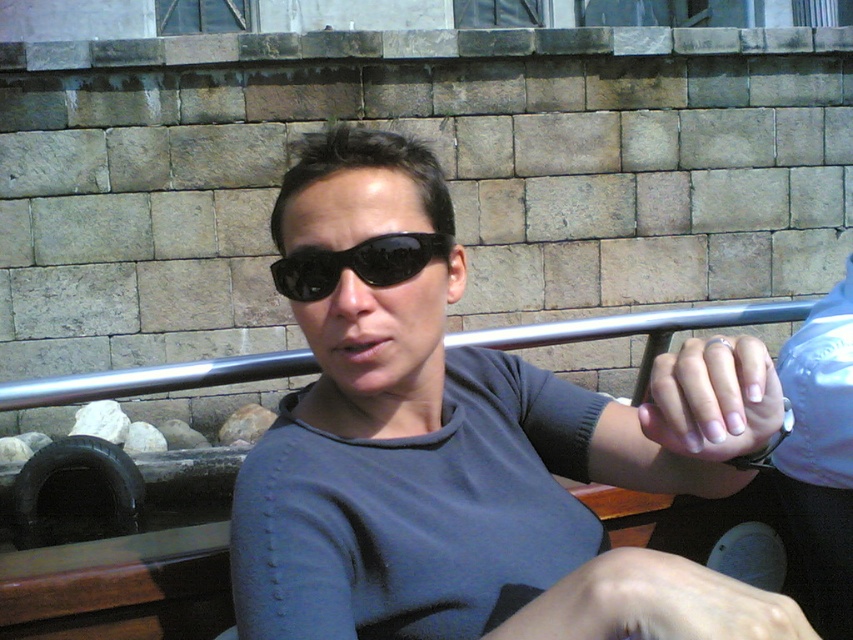
You are a photographer trying to capture a clear shot of the person sitting on the boat. You notice two pairs of sunglasses at the center. Which one is closer to the camera, the matte black sunglasses at center or the black matte sunglasses at center?

The matte black sunglasses at center is closer to the camera because it is in front of the black matte sunglasses at center.

You are a photographer taking a closeup shot of the person in the scene. You notice the white polished nails at center and the black matte sunglasses at center. Which object is positioned higher in the frame?

The white polished nails at center is taller than the black matte sunglasses at center, so the white polished nails at center is positioned higher in the frame.